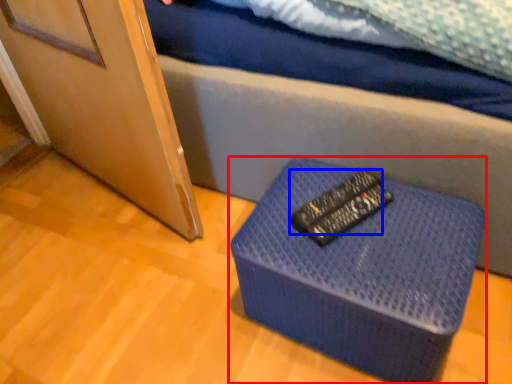
Question: Which of the following is the farthest to the observer, furniture (highlighted by a red box) or control (highlighted by a blue box)?

Choices:
 (A) furniture
 (B) control

Answer: (B)